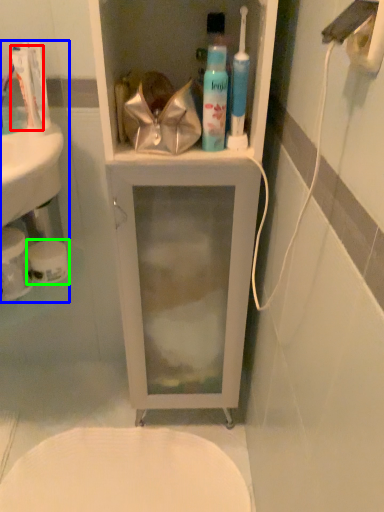
Question: Based on their relative distances, which object is farther from toothpaste (highlighted by a red box)? Choose from sink (highlighted by a blue box) and toilet paper (highlighted by a green box).

Choices:
 (A) sink
 (B) toilet paper

Answer: (B)